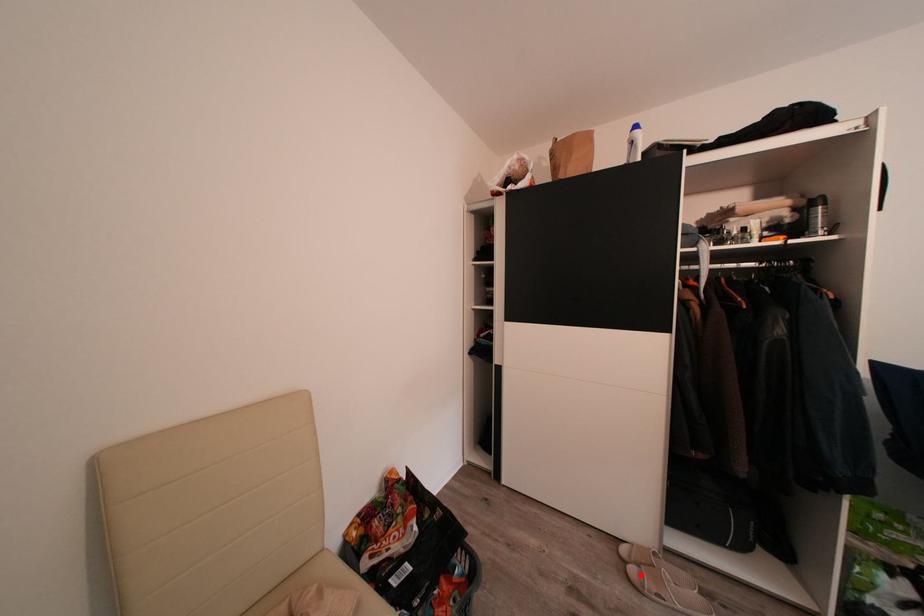
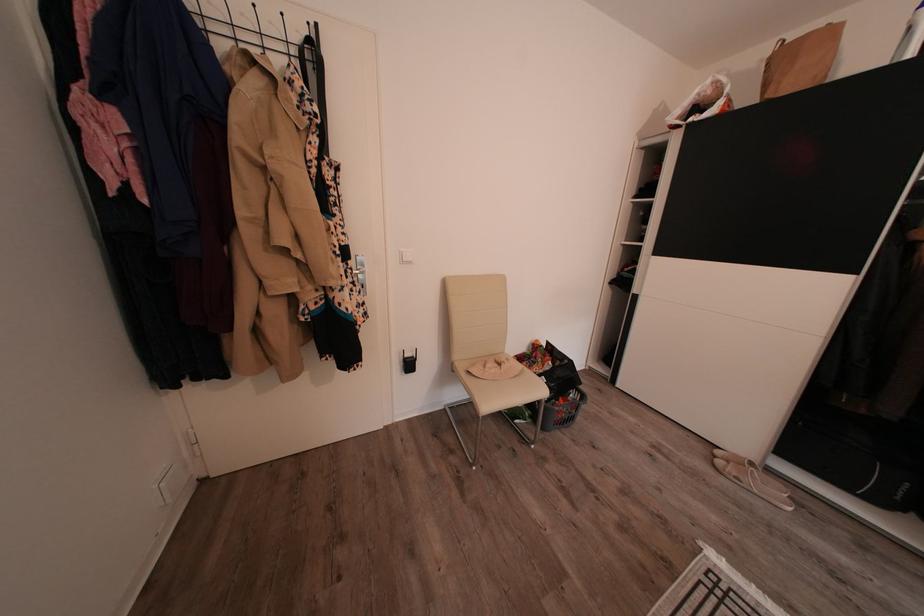
Find the pixel in the second image that matches the highlighted location in the first image.

(728, 468)